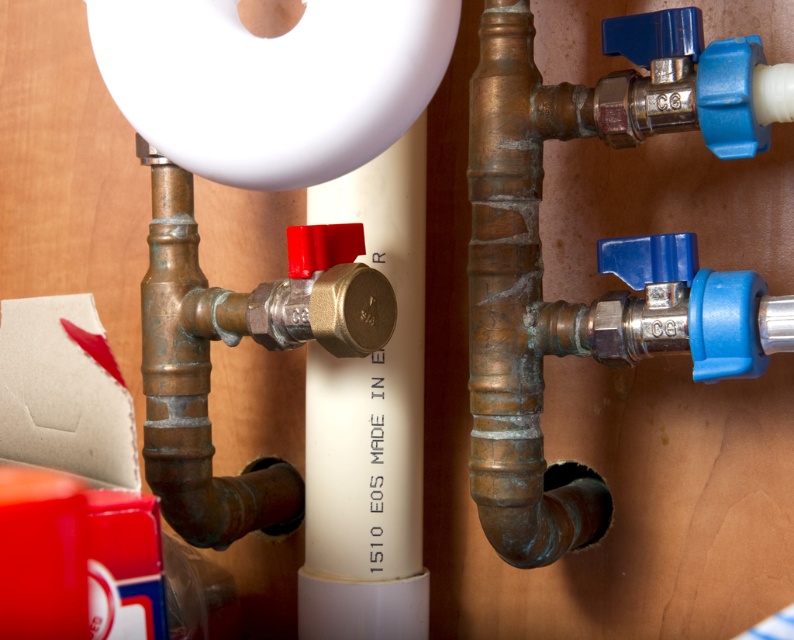
Where is the bronze copper pipe at center located in the image?

The bronze copper pipe at center is located at point (x=596, y=250) in the image.

You are a plumber working on a water system installation. You have two pipes in front of you, the bronze copper pipe at center and the brass water pipe at center. Which one has a smaller diameter?

The bronze copper pipe at center has a lesser width compared to brass water pipe at center, so the bronze copper pipe at center has a smaller diameter.